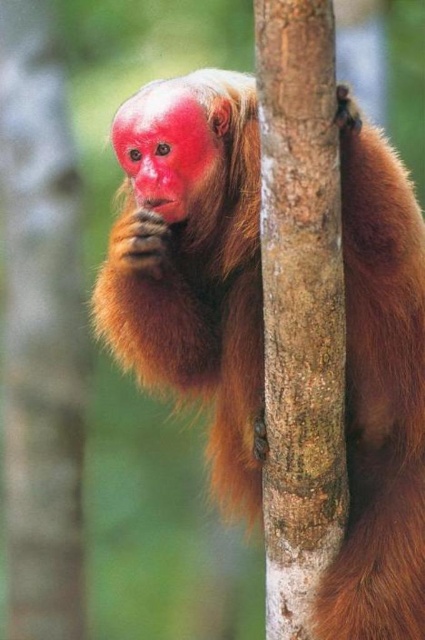
You are a biologist observing the howler monkey in its habitat. You notice the smooth brown bark at center and the pink matte nose at upper center. Which object occupies more horizontal space in the image?

The smooth brown bark at center occupies more horizontal space than the pink matte nose at upper center because its width is larger.